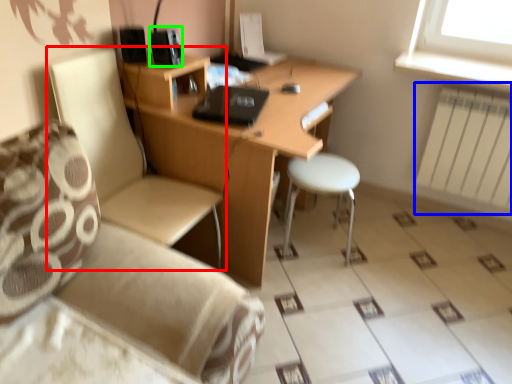
Question: Which is farther away from chair (highlighted by a red box)? radiator (highlighted by a blue box) or speaker (highlighted by a green box)?

Choices:
 (A) radiator
 (B) speaker

Answer: (A)